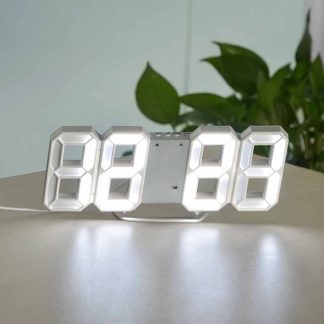
Locate an element on the screen. This screenshot has width=324, height=324. corner is located at coordinates (189, 14).